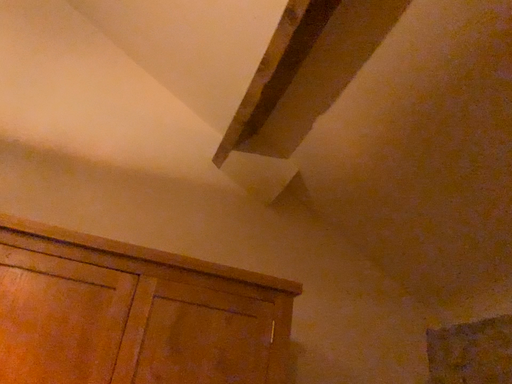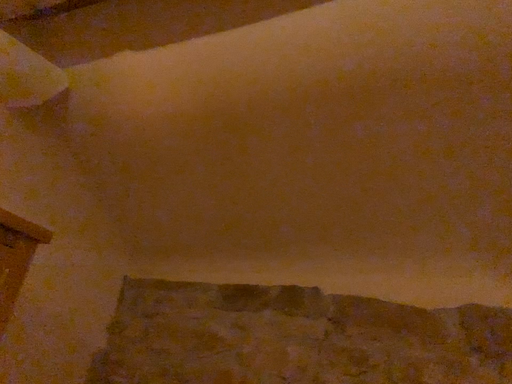
Question: How did the camera likely rotate when shooting the video?

Choices:
 (A) rotated downward
 (B) rotated upward

Answer: (A)